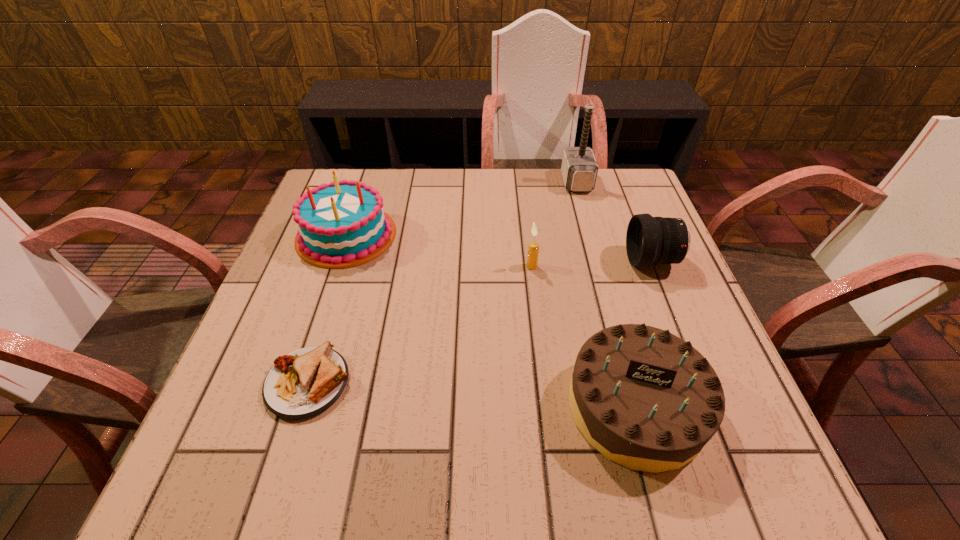
Locate an element on the screen. vacant space at the near edge of the desktop is located at coordinates (472, 460).

This screenshot has height=540, width=960. In order to click on free space at the left edge in this screenshot , I will do `click(265, 435)`.

The image size is (960, 540). I want to click on vacant space at the right edge of the desktop, so click(704, 345).

Where is `free space between the sandwich and the shorter birthday cake`? This screenshot has height=540, width=960. free space between the sandwich and the shorter birthday cake is located at coordinates (471, 395).

You are a GUI agent. You are given a task and a screenshot of the screen. Output one action in this format:
    pyautogui.click(x=<x>, y=<y>)
    Task: Click on the unoccupied position between the right birthday cake and the hammer
    
    Given the screenshot: What is the action you would take?
    pyautogui.click(x=606, y=294)

The image size is (960, 540). I want to click on empty location between the sandwich and the telephoto lens, so click(x=480, y=322).

The height and width of the screenshot is (540, 960). I want to click on empty location between the taller birthday cake and the candle, so click(439, 251).

What are the coordinates of `free space between the tallest object and the taller birthday cake` in the screenshot? It's located at (462, 208).

Where is `empty location between the taller birthday cake and the shortest object`? The width and height of the screenshot is (960, 540). empty location between the taller birthday cake and the shortest object is located at coordinates (327, 309).

You are a GUI agent. You are given a task and a screenshot of the screen. Output one action in this format:
    pyautogui.click(x=<x>, y=<y>)
    Task: Click on the empty location between the farthest object and the telephoto lens
    
    Given the screenshot: What is the action you would take?
    pos(614,221)